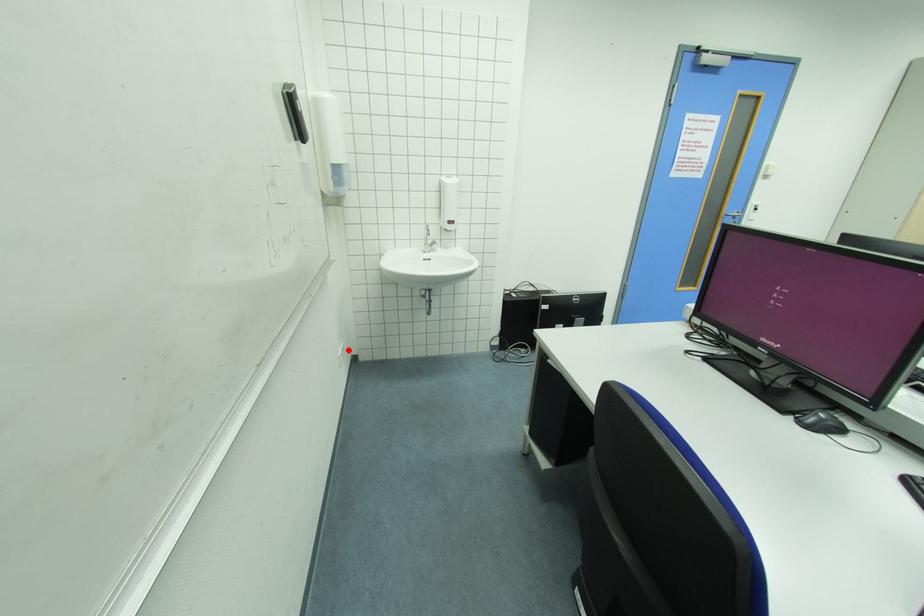
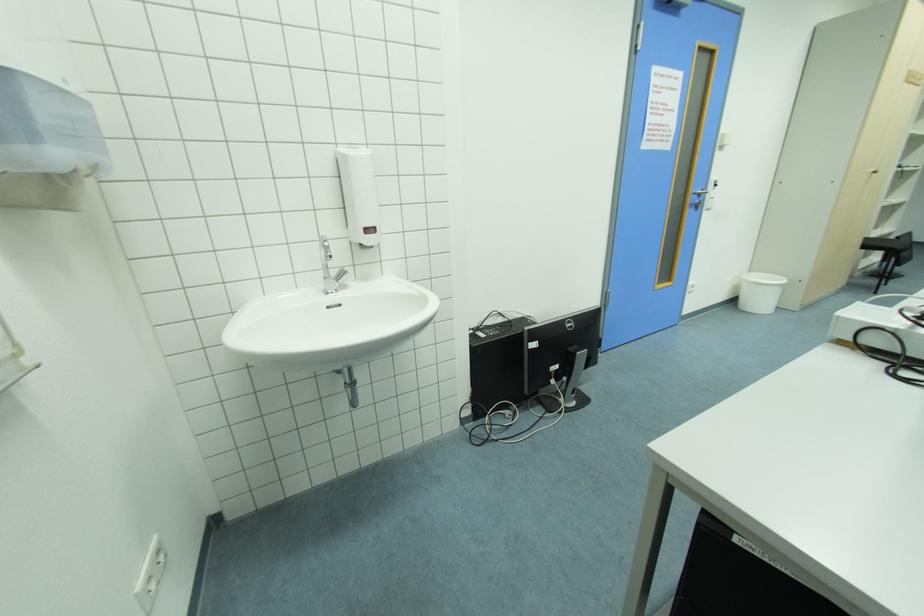
Question: I am providing you with two images of the same scene from different viewpoints. In image1, a red point is highlighted. Considering the same 3D point in image2, which of the following is correct?

Choices:
 (A) It is closer
 (B) It is farther

Answer: (B)